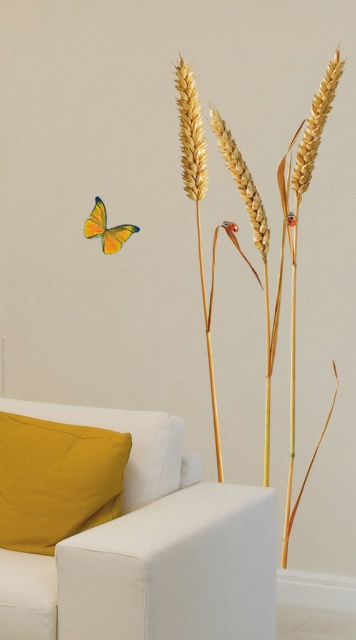
Question: Among these points, which one is farthest from the camera?

Choices:
 (A) (107, 244)
 (B) (158, 637)

Answer: (A)

Question: Estimate the real-world distances between objects in this image. Which object is farther from the white fabric couch at lower left?

Choices:
 (A) mustard fabric pillow at lower left
 (B) dry wheat stalks at center
 (C) yellow-green matte butterfly at lower left

Answer: (C)

Question: In this image, where is mustard fabric pillow at lower left located relative to dry wheat stalks at center?

Choices:
 (A) left
 (B) right

Answer: (A)

Question: Which point appears closest to the camera in this image?

Choices:
 (A) tap(119, 225)
 (B) tap(103, 456)
 (C) tap(140, 435)
 (D) tap(292, 269)

Answer: (B)

Question: Considering the relative positions of white fabric couch at lower left and yellow-green matte butterfly at lower left in the image provided, where is white fabric couch at lower left located with respect to yellow-green matte butterfly at lower left?

Choices:
 (A) left
 (B) right

Answer: (B)

Question: Is dry wheat stalks at center closer to the viewer compared to yellow-green matte butterfly at lower left?

Choices:
 (A) yes
 (B) no

Answer: (A)